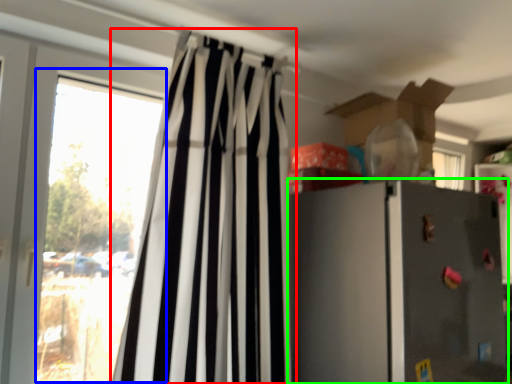
Question: Considering the real-world distances, which object is farthest from curtain (highlighted by a red box)? window (highlighted by a blue box) or refrigerator (highlighted by a green box)?

Choices:
 (A) window
 (B) refrigerator

Answer: (B)